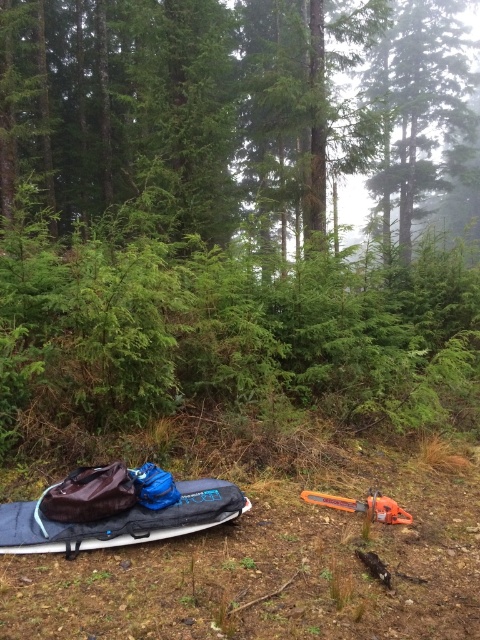
Who is positioned more to the right, green matte tree at center or dark blue fabric kayak at lower left?

green matte tree at center is more to the right.

Can you confirm if green matte tree at center is positioned below dark blue fabric kayak at lower left?

Actually, green matte tree at center is above dark blue fabric kayak at lower left.

Is point (202, 65) behind point (223, 492)?

Yes, point (202, 65) is behind point (223, 492).

Find the location of `green matte tree at center`. green matte tree at center is located at coordinates (216, 104).

Can you confirm if green matte tree at center is taller than green matte tree at upper center?

No, green matte tree at center is not taller than green matte tree at upper center.

Which is more to the right, green matte tree at center or green matte tree at upper center?

green matte tree at upper center

Who is more distant from viewer, (x=232, y=177) or (x=382, y=68)?

The point (x=382, y=68) is behind.

At what (x,y) coordinates should I click in order to perform the action: click on green matte tree at center. Please return your answer as a coordinate pair (x, y). Looking at the image, I should click on (216, 104).

Which of these two, green matte tree at upper center or orange plastic chainsaw at lower right, stands shorter?

With less height is orange plastic chainsaw at lower right.

Does point (408, 100) come in front of point (379, 502)?

No, it is not.

Identify the location of green matte tree at upper center. The height and width of the screenshot is (640, 480). (418, 102).

The image size is (480, 640). I want to click on green matte tree at upper center, so click(418, 102).